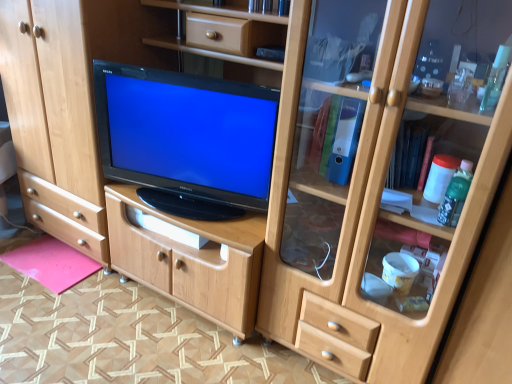
Locate an element on the screen. Image resolution: width=512 pixels, height=384 pixels. free space in front of pink matte mat at lower left is located at coordinates (32, 301).